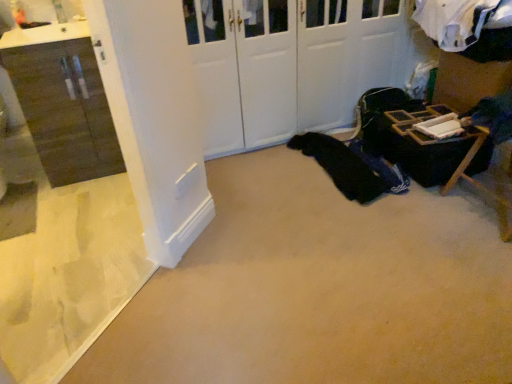
At what (x,y) coordinates should I click in order to perform the action: click on white matte door at center. Please return your answer as a coordinate pair (x, y). The image size is (512, 384). Looking at the image, I should click on (288, 64).

Describe the element at coordinates (288, 64) in the screenshot. This screenshot has width=512, height=384. I see `white matte door at center` at that location.

In order to click on matte brown cabinet at left in this screenshot , I will do `click(65, 109)`.

This screenshot has height=384, width=512. What do you see at coordinates (421, 146) in the screenshot?
I see `wooden folding table at lower right` at bounding box center [421, 146].

Measure the distance between wooden folding table at lower right and camera.

wooden folding table at lower right is 7.24 feet from camera.

Find the location of `white matte door at center`. white matte door at center is located at coordinates (288, 64).

In the scene shown: Which of these two, white matte door at center or matte brown cabinet at left, stands shorter?

matte brown cabinet at left is shorter.

Considering the sizes of objects white matte door at center and matte brown cabinet at left in the image provided, who is wider, white matte door at center or matte brown cabinet at left?

Wider between the two is white matte door at center.

Is white matte door at center touching matte brown cabinet at left?

They are not placed beside each other.

At what (x,y) coordinates should I click in order to perform the action: click on cabinetry beneath the white matte door at center (from a real-world perspective). Please return your answer as a coordinate pair (x, y). The image size is (512, 384). Looking at the image, I should click on (65, 109).

In the scene shown: Is matte brown cabinet at left shorter than wooden folding table at lower right?

Incorrect, the height of matte brown cabinet at left does not fall short of that of wooden folding table at lower right.

Which object is thinner, matte brown cabinet at left or wooden folding table at lower right?

Thinner between the two is matte brown cabinet at left.

Is matte brown cabinet at left turned away from wooden folding table at lower right?

No, matte brown cabinet at left's orientation is not away from wooden folding table at lower right.

Is matte brown cabinet at left situated inside wooden folding table at lower right or outside?

matte brown cabinet at left exists outside the volume of wooden folding table at lower right.

From a real-world perspective, is matte brown cabinet at left beneath white matte door at center?

Indeed, from a real-world perspective, matte brown cabinet at left is positioned beneath white matte door at center.

From the image's perspective, is matte brown cabinet at left on top of white matte door at center?

No, from the image's perspective, matte brown cabinet at left is not on top of white matte door at center.

Between matte brown cabinet at left and white matte door at center, which one is positioned in front?

matte brown cabinet at left is more forward.

Identify the location of cabinetry below the white matte door at center (from a real-world perspective). (65, 109).

Image resolution: width=512 pixels, height=384 pixels. I want to click on clothing behind the matte brown cabinet at left, so click(345, 166).

Considering the relative sizes of matte brown cabinet at left and black fabric at center in the image provided, is matte brown cabinet at left taller than black fabric at center?

Indeed, matte brown cabinet at left has a greater height compared to black fabric at center.

Between matte brown cabinet at left and black fabric at center, which one appears on the right side from the viewer's perspective?

black fabric at center is more to the right.

Is matte brown cabinet at left positioned in front of black fabric at center?

Yes, the depth of matte brown cabinet at left is less than that of black fabric at center.

Is point (484, 146) more distant than point (306, 137)?

No, it is not.

This screenshot has width=512, height=384. What are the coordinates of `furniture in front of the black fabric at center` in the screenshot? It's located at (421, 146).

Can you tell me how much wooden folding table at lower right and black fabric at center differ in facing direction?

wooden folding table at lower right and black fabric at center are facing 92 degrees away from each other.

Choose the correct answer: Is wooden folding table at lower right inside black fabric at center or outside it?

wooden folding table at lower right exists outside the volume of black fabric at center.

Between point (395, 125) and point (240, 113), which one is positioned in front?

The point (395, 125) is in front.

Is wooden folding table at lower right further to camera compared to white matte door at center?

No, wooden folding table at lower right is closer to the viewer.

Considering the relative sizes of wooden folding table at lower right and white matte door at center in the image provided, is wooden folding table at lower right bigger than white matte door at center?

No, wooden folding table at lower right is not bigger than white matte door at center.

Does wooden folding table at lower right have a lesser height compared to white matte door at center?

Yes, wooden folding table at lower right is shorter than white matte door at center.

Which is more to the right, black fabric at center or wooden folding table at lower right?

From the viewer's perspective, wooden folding table at lower right appears more on the right side.

Consider the image. Is black fabric at center turned away from wooden folding table at lower right?

black fabric at center does not have its back to wooden folding table at lower right.

In the scene shown: Does black fabric at center have a greater height compared to wooden folding table at lower right?

Incorrect, the height of black fabric at center is not larger of that of wooden folding table at lower right.

What are the coordinates of `cabinetry on the left side of white matte door at center` in the screenshot? It's located at (65, 109).

The height and width of the screenshot is (384, 512). In order to click on cabinetry above the wooden folding table at lower right (from a real-world perspective) in this screenshot , I will do coord(65,109).

From the image, which object appears to be farther from wooden folding table at lower right, white matte door at center or matte brown cabinet at left?

matte brown cabinet at left is positioned further to the anchor wooden folding table at lower right.

Considering their positions, is wooden folding table at lower right positioned further to matte brown cabinet at left than white matte door at center?

wooden folding table at lower right.

Estimate the real-world distances between objects in this image. Which object is further from black fabric at center, white matte door at center or matte brown cabinet at left?

matte brown cabinet at left is further to black fabric at center.

Which object lies further to the anchor point matte brown cabinet at left, wooden folding table at lower right or black fabric at center?

Based on the image, wooden folding table at lower right appears to be further to matte brown cabinet at left.

From the picture: From the image, which object appears to be nearer to matte brown cabinet at left, black fabric at center or wooden folding table at lower right?

black fabric at center.

When comparing their distances from matte brown cabinet at left, does white matte door at center or wooden folding table at lower right seem further?

wooden folding table at lower right is positioned further to the anchor matte brown cabinet at left.

Which object lies further to the anchor point white matte door at center, wooden folding table at lower right or matte brown cabinet at left?

matte brown cabinet at left.

Based on the photo, from the image, which object appears to be nearer to white matte door at center, black fabric at center or matte brown cabinet at left?

black fabric at center.

Locate an element on the screen. The image size is (512, 384). furniture between white matte door at center and black fabric at center in the vertical direction is located at coordinates (421, 146).

Where is `clothing located between matte brown cabinet at left and wooden folding table at lower right in the left-right direction`? clothing located between matte brown cabinet at left and wooden folding table at lower right in the left-right direction is located at coordinates (345, 166).

Locate an element on the screen. The image size is (512, 384). door situated between matte brown cabinet at left and black fabric at center from left to right is located at coordinates (288, 64).

Where is `door between matte brown cabinet at left and wooden folding table at lower right in the horizontal direction`? Image resolution: width=512 pixels, height=384 pixels. door between matte brown cabinet at left and wooden folding table at lower right in the horizontal direction is located at coordinates (288, 64).